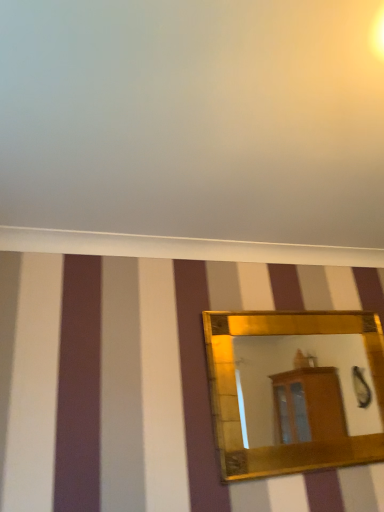
This screenshot has height=512, width=384. Describe the element at coordinates (291, 369) in the screenshot. I see `gold reflective mirror at center` at that location.

Find the location of a particular element. This screenshot has height=512, width=384. gold reflective mirror at center is located at coordinates (291, 369).

Identify the location of gold reflective mirror at center. The image size is (384, 512). (291, 369).